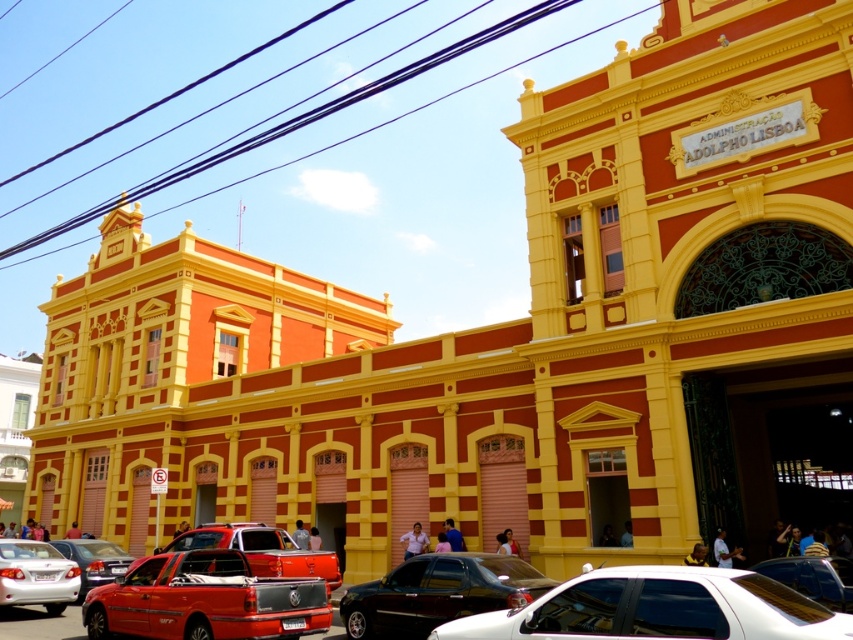
From the picture: You are a delivery driver who needs to park your truck between the white glossy car at lower center and the white matte sedan at lower left. Your truck is 10 meters long. Can you fit your truck in the space between them?

The distance between the white glossy car at lower center and the white matte sedan at lower left is 32.64 meters. Since your truck is only 10 meters long, there is more than enough space to park it between them.

You are a delivery person who needs to park your vehicle in this area. You have a white glossy car at lower center and a shiny silver car at lower right. Which car requires more space to park?

The white glossy car at lower center requires more space to park because it is bigger than the shiny silver car at lower right.